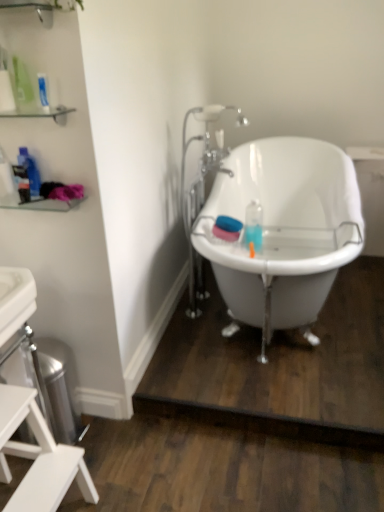
This screenshot has height=512, width=384. I want to click on free space in front of chrome metallic faucet at center, so point(210,337).